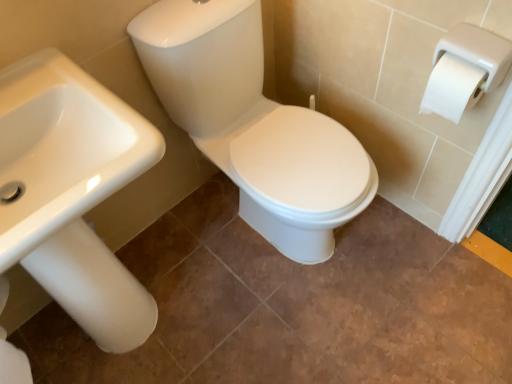
Question: From the image's perspective, relative to white glossy sink at left, is white glossy toilet seat at center above or below?

Choices:
 (A) above
 (B) below

Answer: (A)

Question: Looking at the image, does white glossy toilet seat at center seem bigger or smaller compared to white glossy sink at left?

Choices:
 (A) small
 (B) big

Answer: (B)

Question: From a real-world perspective, is white glossy toilet seat at center positioned above or below white glossy sink at left?

Choices:
 (A) below
 (B) above

Answer: (A)

Question: Would you say white glossy sink at left is inside or outside white glossy toilet seat at center?

Choices:
 (A) outside
 (B) inside

Answer: (A)

Question: Relative to white glossy toilet seat at center, is white glossy sink at left in front or behind?

Choices:
 (A) front
 (B) behind

Answer: (A)

Question: In terms of height, does white glossy sink at left look taller or shorter compared to white glossy toilet seat at center?

Choices:
 (A) short
 (B) tall

Answer: (B)

Question: From a real-world perspective, is white glossy sink at left positioned above or below white glossy toilet seat at center?

Choices:
 (A) above
 (B) below

Answer: (A)